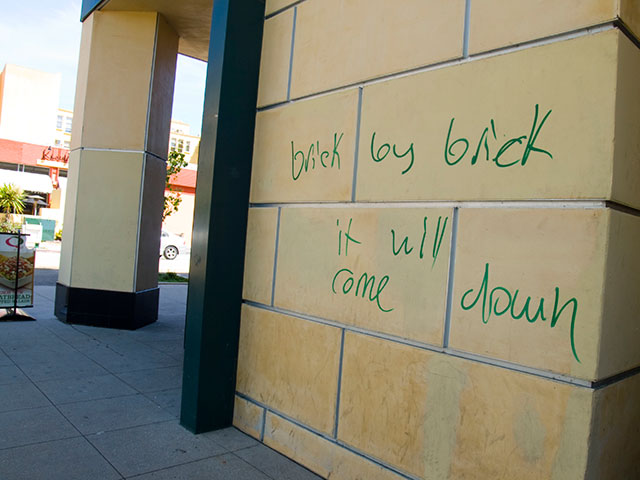
Locate an element on the screen. This screenshot has width=640, height=480. poster is located at coordinates click(x=8, y=274).